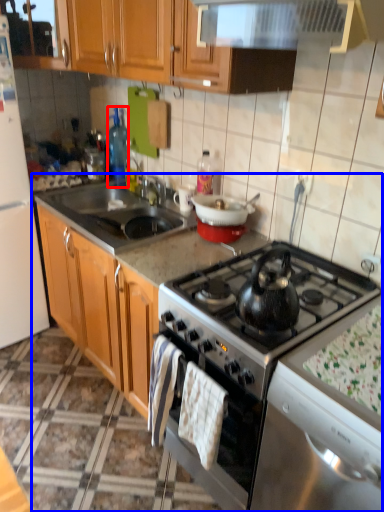
Question: Among these objects, which one is nearest to the camera, bottle (highlighted by a red box) or countertop (highlighted by a blue box)?

Choices:
 (A) bottle
 (B) countertop

Answer: (B)